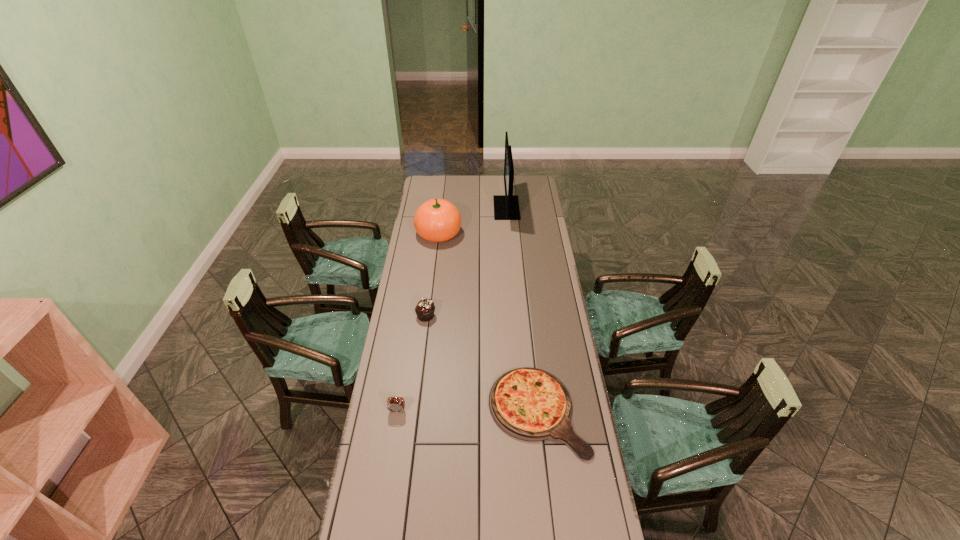
Find the location of a particular element. free point between the cupcake and the tallest object is located at coordinates (467, 262).

The image size is (960, 540). Identify the location of object that ranks as the second closest to the pumpkin. (425, 308).

Locate which object ranks second in proximity to the alarm clock. Please provide its 2D coordinates. Your answer should be formatted as a tuple, i.e. [(x, y)], where the tuple contains the x and y coordinates of a point satisfying the conditions above.

[(425, 308)]

Find the location of `free space in the image that satisfies the following two spatial constraints: 1. on the face of the alarm clock; 2. on the right side of the pizza`. free space in the image that satisfies the following two spatial constraints: 1. on the face of the alarm clock; 2. on the right side of the pizza is located at coordinates (397, 411).

Where is `vacant space that satisfies the following two spatial constraints: 1. on the back side of the cupcake; 2. on the left side of the second tallest object`? vacant space that satisfies the following two spatial constraints: 1. on the back side of the cupcake; 2. on the left side of the second tallest object is located at coordinates (436, 234).